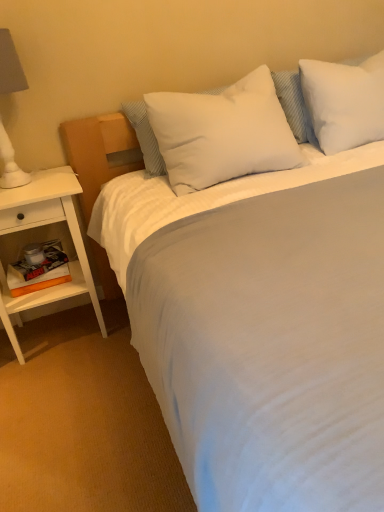
You are a GUI agent. You are given a task and a screenshot of the screen. Output one action in this format:
    pyautogui.click(x=<x>, y=<y>)
    Task: Click on the vacant space in white wood nightstand at left (from a real-world perspective)
    This screenshot has height=512, width=384.
    Given the screenshot: What is the action you would take?
    pyautogui.click(x=61, y=332)